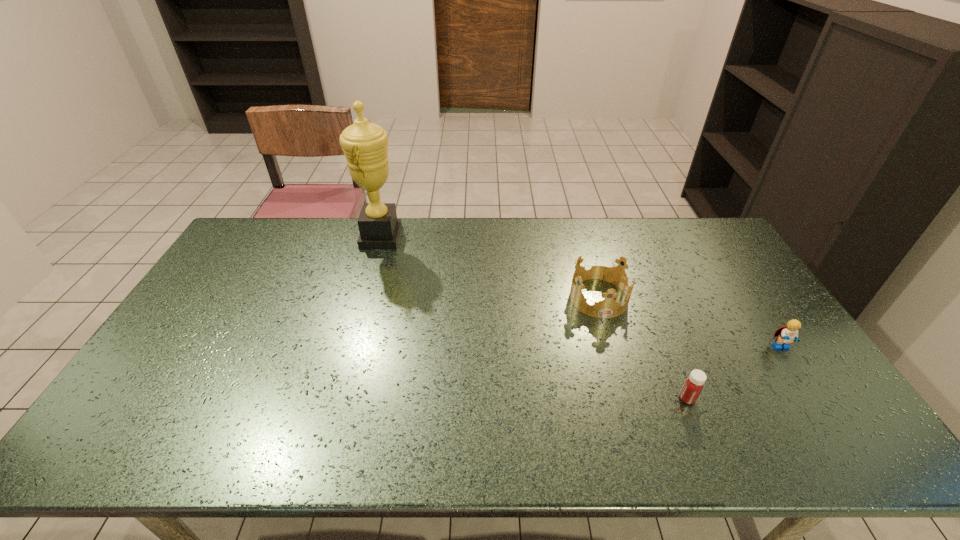
At what (x,y) coordinates should I click in order to perform the action: click on vacant space in between the trophy cup and the second farthest object. Please return your answer as a coordinate pair (x, y). Image resolution: width=960 pixels, height=540 pixels. Looking at the image, I should click on (490, 267).

Find the location of a particular element. vacant region between the Lego and the nearest object is located at coordinates (734, 373).

Locate an element on the screen. empty space that is in between the nearest object and the leftmost object is located at coordinates (534, 318).

Where is `empty space between the rightmost object and the third nearest object`? Image resolution: width=960 pixels, height=540 pixels. empty space between the rightmost object and the third nearest object is located at coordinates (690, 322).

Where is `empty space between the farthest object and the second farthest object`? This screenshot has width=960, height=540. empty space between the farthest object and the second farthest object is located at coordinates pyautogui.click(x=490, y=267).

Where is `object that stands as the third closest to the medicine`? The width and height of the screenshot is (960, 540). object that stands as the third closest to the medicine is located at coordinates (364, 144).

Locate which object is the closest to the second object from right to left. Please provide its 2D coordinates. Your answer should be formatted as a tuple, i.e. [(x, y)], where the tuple contains the x and y coordinates of a point satisfying the conditions above.

[(608, 308)]

At what (x,y) coordinates should I click in order to perform the action: click on vacant region that satisfies the following two spatial constraints: 1. at the front of the leftmost object with handles; 2. on the back side of the medicine. Please return your answer as a coordinate pair (x, y). The height and width of the screenshot is (540, 960). Looking at the image, I should click on (335, 399).

At what (x,y) coordinates should I click in order to perform the action: click on vacant space that satisfies the following two spatial constraints: 1. on the front-facing side of the tiara; 2. on the right side of the medicine. Please return your answer as a coordinate pair (x, y). The image size is (960, 540). Looking at the image, I should click on (628, 399).

Locate an element on the screen. vacant region that satisfies the following two spatial constraints: 1. on the front-facing side of the nearest object; 2. on the left side of the third nearest object is located at coordinates (628, 399).